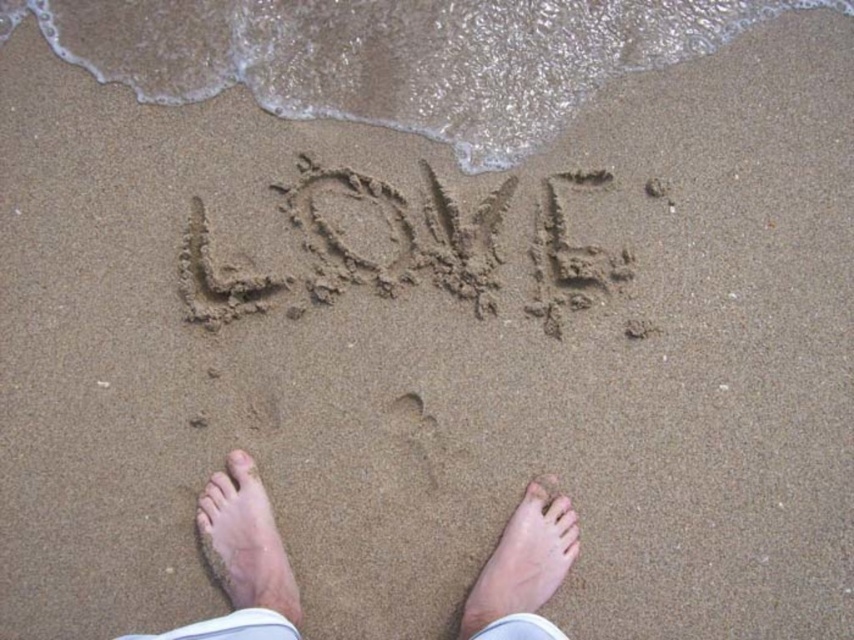
I want to click on dark brown sand at center, so click(354, 246).

What do you see at coordinates (354, 246) in the screenshot? This screenshot has height=640, width=854. I see `dark brown sand at center` at bounding box center [354, 246].

Is point (185, 296) positioned in front of point (243, 614)?

No.

Identify the location of dark brown sand at center. The image size is (854, 640). click(x=354, y=246).

Does dark brown sand at center appear on the right side of smooth skin foot at lower center?

In fact, dark brown sand at center is to the left of smooth skin foot at lower center.

Which is behind, point (320, 269) or point (516, 586)?

The point (320, 269) is behind.

Locate an element on the screen. dark brown sand at center is located at coordinates (354, 246).

Is dark brown sand at center above light skin tone foot at lower center?

Indeed, dark brown sand at center is positioned over light skin tone foot at lower center.

Is dark brown sand at center wider than light skin tone foot at lower center?

Yes, dark brown sand at center is wider than light skin tone foot at lower center.

Between point (344, 170) and point (208, 545), which one is positioned in front?

Point (208, 545) is in front.

The height and width of the screenshot is (640, 854). What are the coordinates of `dark brown sand at center` in the screenshot? It's located at (354, 246).